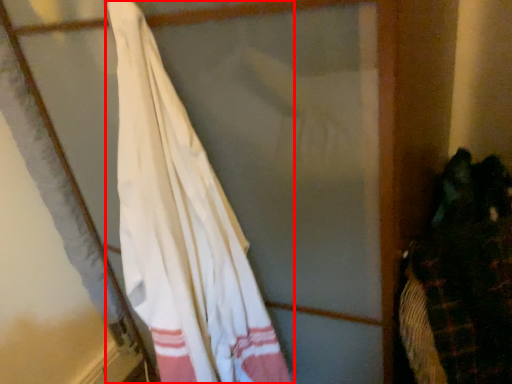
Question: From the image, what is the correct spatial relationship of curtain (annotated by the red box) in relation to laundry?

Choices:
 (A) left
 (B) right

Answer: (A)